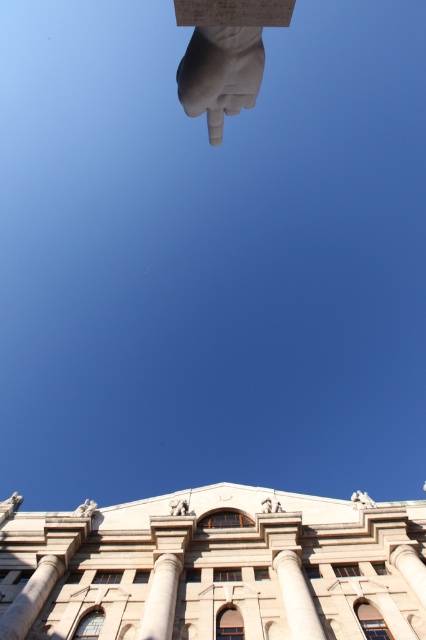
Question: Where is white marble pillar at lower left located in relation to white marble pigeons at upper center in the image?

Choices:
 (A) below
 (B) above

Answer: (B)

Question: Where is white marble column at center located in relation to white marble pillar at center in the image?

Choices:
 (A) below
 (B) above

Answer: (A)

Question: Can you confirm if white marble pillar at lower left is positioned above white marble pigeons at upper center?

Choices:
 (A) no
 (B) yes

Answer: (B)

Question: Which object is the farthest from the white marble hand at upper center?

Choices:
 (A) polished bronze statue at center
 (B) white stone lion at upper left

Answer: (B)

Question: Which object is positioned closest to the white marble pillar at center?

Choices:
 (A) white marble pillar at lower center
 (B) white stone lion at upper center
 (C) white stone lion at upper left
 (D) white marble pigeons at upper center

Answer: (B)

Question: Among these objects, which one is nearest to the camera?

Choices:
 (A) white marble hand at upper center
 (B) white stone lion at upper left

Answer: (A)